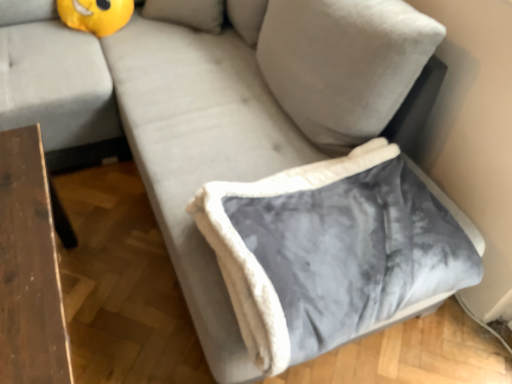
The image size is (512, 384). What do you see at coordinates (330, 249) in the screenshot? I see `velvet gray bean bag chair at lower right` at bounding box center [330, 249].

The height and width of the screenshot is (384, 512). What are the coordinates of `velvet gray bean bag chair at lower right` in the screenshot? It's located at (330, 249).

At what (x,y) coordinates should I click in order to perform the action: click on velvet gray bean bag chair at lower right. Please return your answer as a coordinate pair (x, y). Looking at the image, I should click on 330,249.